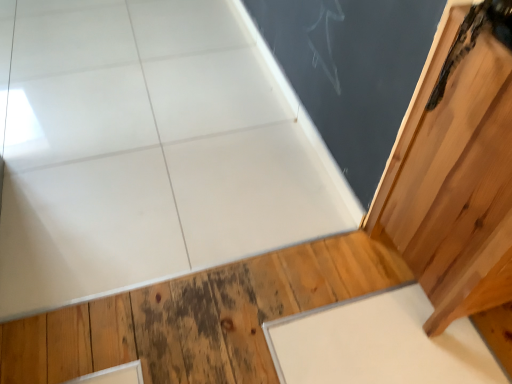
Question: In terms of width, does white matte slate at lower right look wider or thinner when compared to wooden door at upper right?

Choices:
 (A) wide
 (B) thin

Answer: (A)

Question: Considering the positions of white matte slate at lower right and wooden door at upper right in the image, is white matte slate at lower right taller or shorter than wooden door at upper right?

Choices:
 (A) short
 (B) tall

Answer: (A)

Question: Which is farther from the wooden door at upper right?

Choices:
 (A) matte black chalkboard at upper right
 (B) white matte slate at lower right
 (C) natural wood floor at lower right

Answer: (C)

Question: Which of these objects is positioned closest to the matte black chalkboard at upper right?

Choices:
 (A) white matte slate at lower right
 (B) wooden door at upper right
 (C) natural wood floor at lower right

Answer: (B)